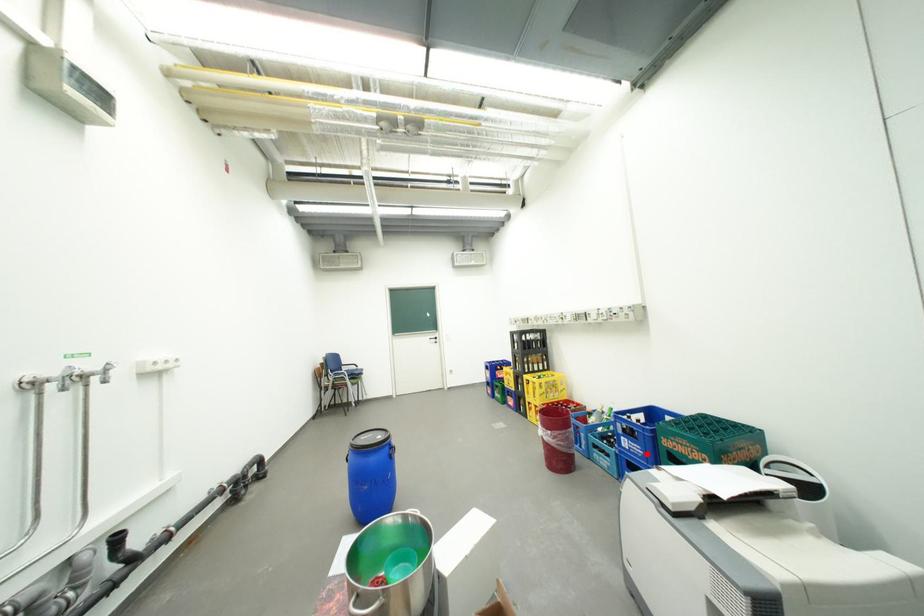
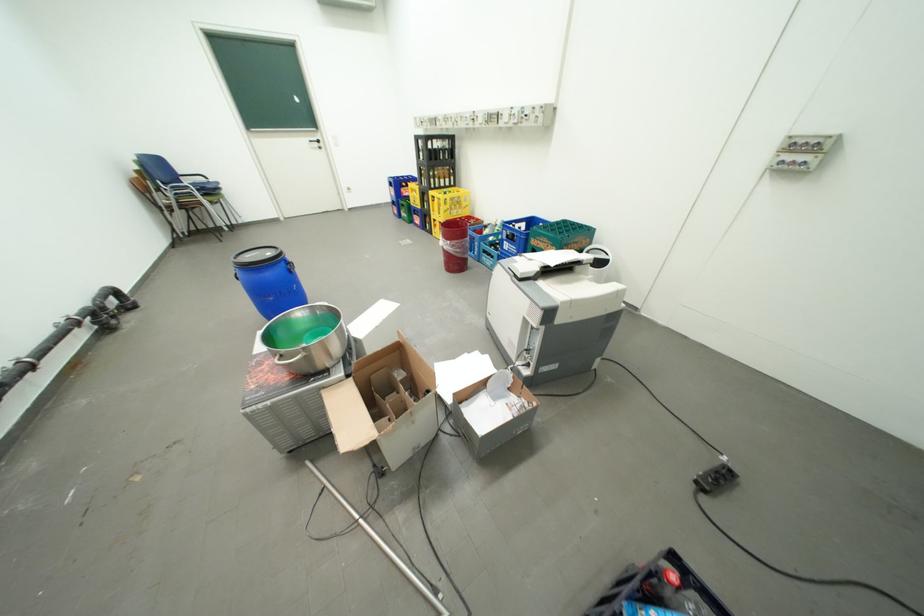
Question: I am providing you with two images of the same scene from different viewpoints. A red point is shown in image1. For the corresponding object point in image2, is it positioned nearer or farther from the camera?

Choices:
 (A) Nearer
 (B) Farther

Answer: (B)